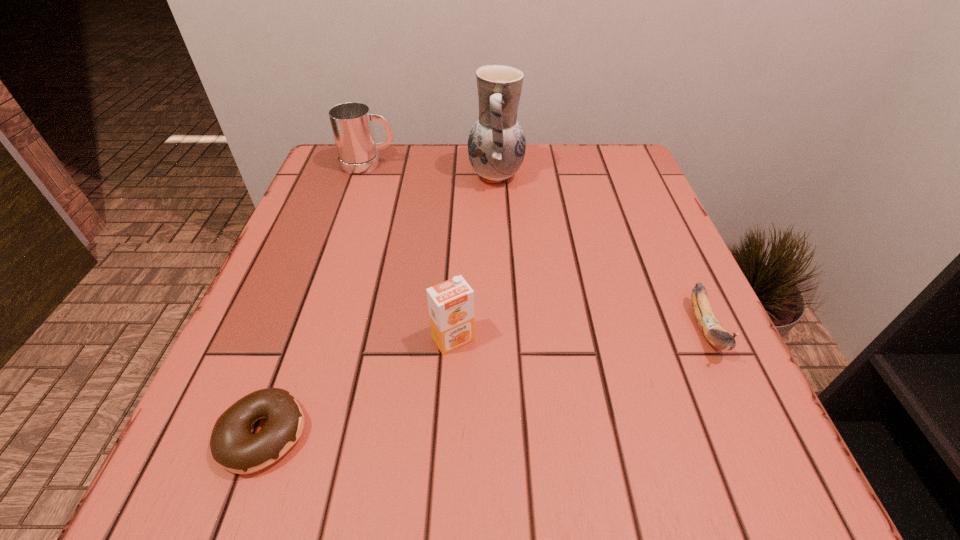
Find the location of `pottery`. pottery is located at coordinates coord(496,144).

Identify the location of mug. (351, 122).

The width and height of the screenshot is (960, 540). Identify the location of orange juice. (451, 303).

Locate an element on the screen. banana is located at coordinates (710, 326).

This screenshot has width=960, height=540. I want to click on the rightmost object, so click(710, 326).

Locate an element on the screen. the nearest object is located at coordinates (234, 447).

Locate an element on the screen. Image resolution: width=960 pixels, height=540 pixels. doughnut is located at coordinates (234, 447).

Where is `vacant region located on either side of the tallest object`? vacant region located on either side of the tallest object is located at coordinates (414, 176).

Identify the location of free location located on either side of the tallest object. This screenshot has height=540, width=960. (389, 176).

Where is `free point located on either side of the tallest object`? This screenshot has width=960, height=540. free point located on either side of the tallest object is located at coordinates (447, 176).